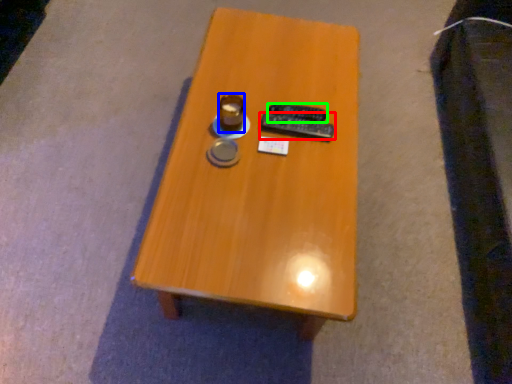
Question: Which object is positioned closest to remote control (highlighted by a red box)? Select from coffee cup (highlighted by a blue box) and remote control (highlighted by a green box).

Choices:
 (A) coffee cup
 (B) remote control

Answer: (B)